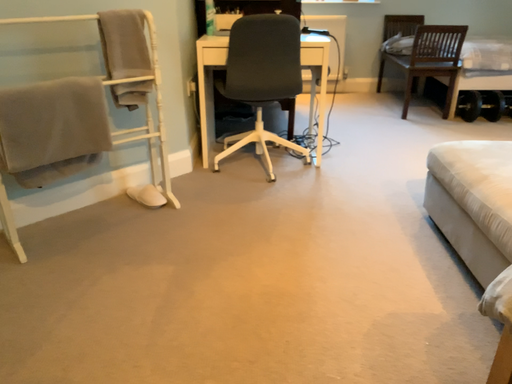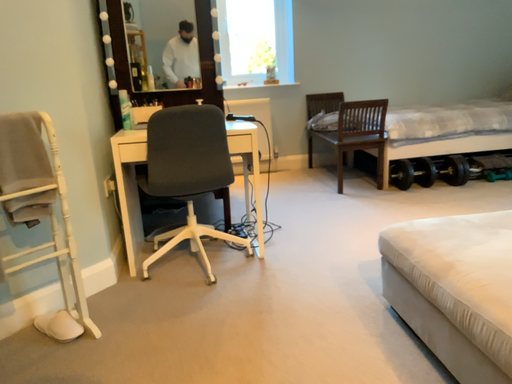
Question: Which way did the camera rotate in the video?

Choices:
 (A) rotated upward
 (B) rotated downward

Answer: (A)